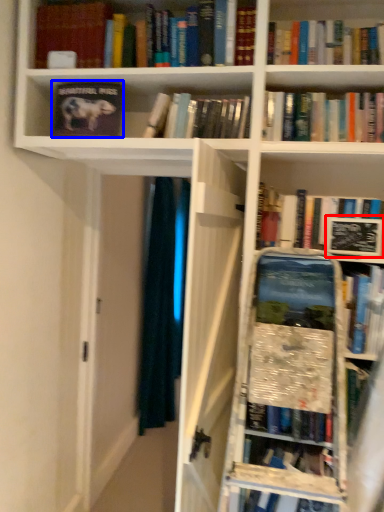
Question: Which object appears farthest to the camera in this image, paperback book (highlighted by a red box) or book (highlighted by a blue box)?

Choices:
 (A) paperback book
 (B) book

Answer: (B)